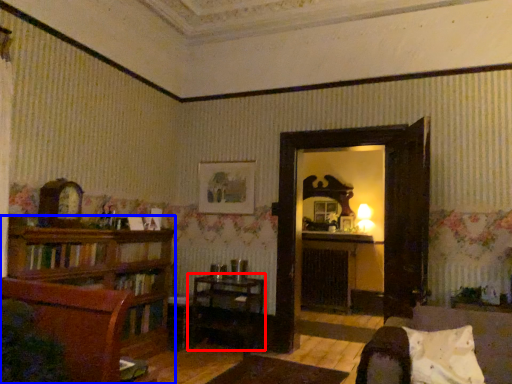
Question: Among these objects, which one is farthest to the camera, table (highlighted by a red box) or shelf (highlighted by a blue box)?

Choices:
 (A) table
 (B) shelf

Answer: (A)